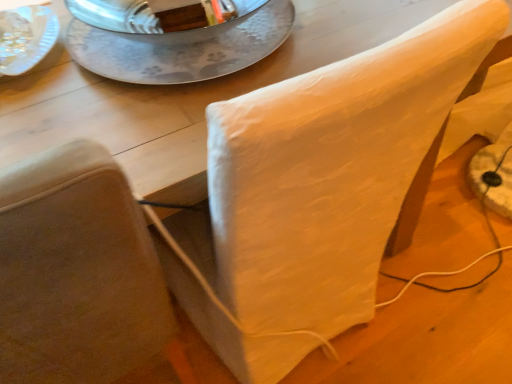
Question: Is silver textured plate at upper center a part of white fabric chair at upper right?

Choices:
 (A) no
 (B) yes

Answer: (A)

Question: From the image's perspective, would you say white fabric chair at upper right is positioned over silver textured plate at upper center?

Choices:
 (A) yes
 (B) no

Answer: (B)

Question: Does white fabric chair at upper right lie behind silver textured plate at upper center?

Choices:
 (A) yes
 (B) no

Answer: (B)

Question: Can you confirm if white fabric chair at upper right is taller than silver textured plate at upper center?

Choices:
 (A) yes
 (B) no

Answer: (A)

Question: Can you confirm if white fabric chair at upper right is thinner than silver textured plate at upper center?

Choices:
 (A) yes
 (B) no

Answer: (B)

Question: Does white fabric chair at upper right appear on the right side of silver textured plate at upper center?

Choices:
 (A) no
 (B) yes

Answer: (A)

Question: Is silver textured plate at upper center positioned with its back to white fabric chair at upper right?

Choices:
 (A) no
 (B) yes

Answer: (A)

Question: Does silver textured plate at upper center have a larger size compared to white fabric chair at upper right?

Choices:
 (A) yes
 (B) no

Answer: (B)

Question: Is silver textured plate at upper center aimed at white fabric chair at upper right?

Choices:
 (A) no
 (B) yes

Answer: (A)

Question: Would you say silver textured plate at upper center contains white fabric chair at upper right?

Choices:
 (A) yes
 (B) no

Answer: (B)

Question: Is silver textured plate at upper center behind white fabric chair at upper right?

Choices:
 (A) yes
 (B) no

Answer: (A)

Question: Is silver textured plate at upper center thinner than white fabric chair at upper right?

Choices:
 (A) no
 (B) yes

Answer: (B)

Question: Is point (96, 190) positioned closer to the camera than point (248, 29)?

Choices:
 (A) closer
 (B) farther

Answer: (A)